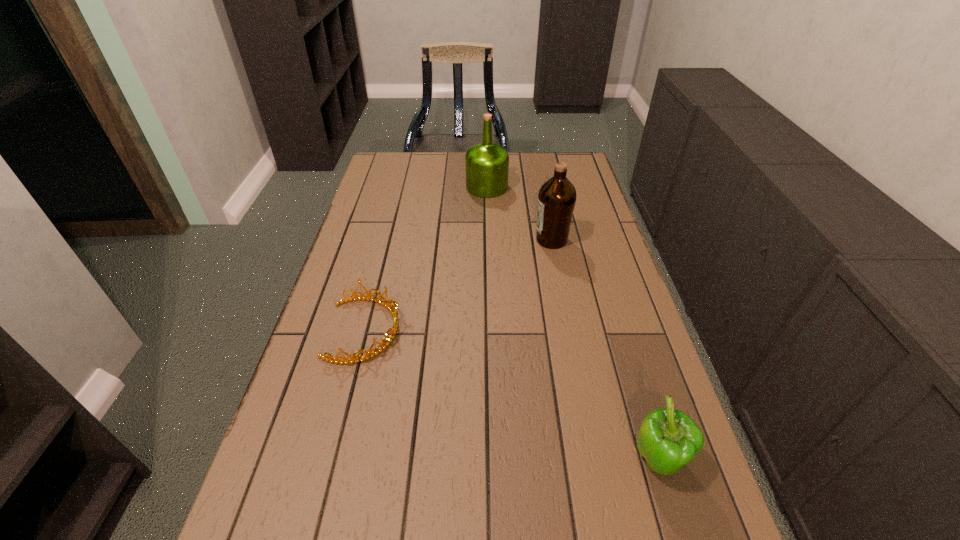
Find the location of a particular element. This screenshot has width=960, height=540. free space at the right edge of the desktop is located at coordinates (604, 383).

Identify the location of free region at the far left corner. (413, 179).

You are a GUI agent. You are given a task and a screenshot of the screen. Output one action in this format:
    pyautogui.click(x=<x>, y=<y>)
    Task: Click on the free space at the far right corner of the desktop
    
    Given the screenshot: What is the action you would take?
    pyautogui.click(x=555, y=165)

The height and width of the screenshot is (540, 960). I want to click on free area in between the second object from left to right and the rightmost object, so click(x=572, y=325).

In order to click on free spot between the nearer olive oil and the rightmost object in this screenshot , I will do `click(605, 351)`.

Where is `free space that is in between the shortest object and the farther olive oil`? Image resolution: width=960 pixels, height=540 pixels. free space that is in between the shortest object and the farther olive oil is located at coordinates (426, 259).

Where is `empty location between the tiara and the farther olive oil`? The height and width of the screenshot is (540, 960). empty location between the tiara and the farther olive oil is located at coordinates point(426,259).

Locate an element on the screen. The width and height of the screenshot is (960, 540). free space between the bell pepper and the right olive oil is located at coordinates (605, 351).

Image resolution: width=960 pixels, height=540 pixels. I want to click on vacant space that is in between the third tallest object and the second nearest object, so click(x=512, y=396).

Image resolution: width=960 pixels, height=540 pixels. In order to click on free space between the second object from right to left and the left olive oil in this screenshot , I will do `click(519, 213)`.